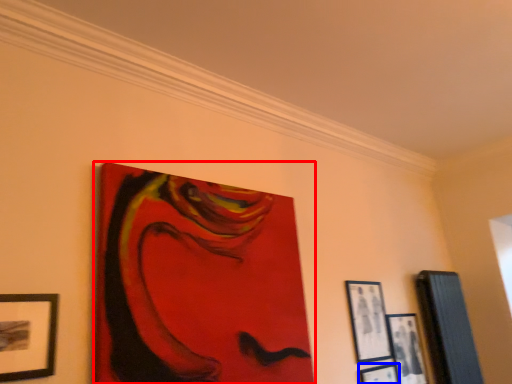
Question: Which object appears farthest to the camera in this image, picture frame (highlighted by a red box) or picture frame (highlighted by a blue box)?

Choices:
 (A) picture frame
 (B) picture frame

Answer: (B)